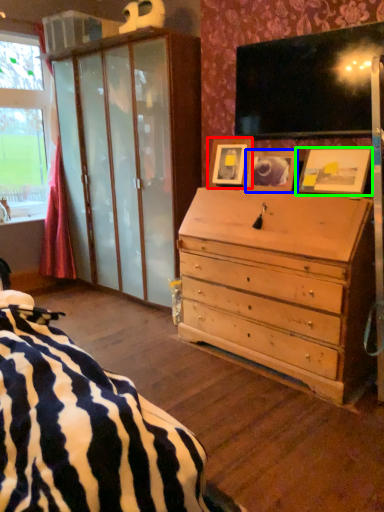
Question: Which is nearer to the picture frame (highlighted by a red box)? picture frame (highlighted by a blue box) or picture frame (highlighted by a green box).

Choices:
 (A) picture frame
 (B) picture frame

Answer: (A)